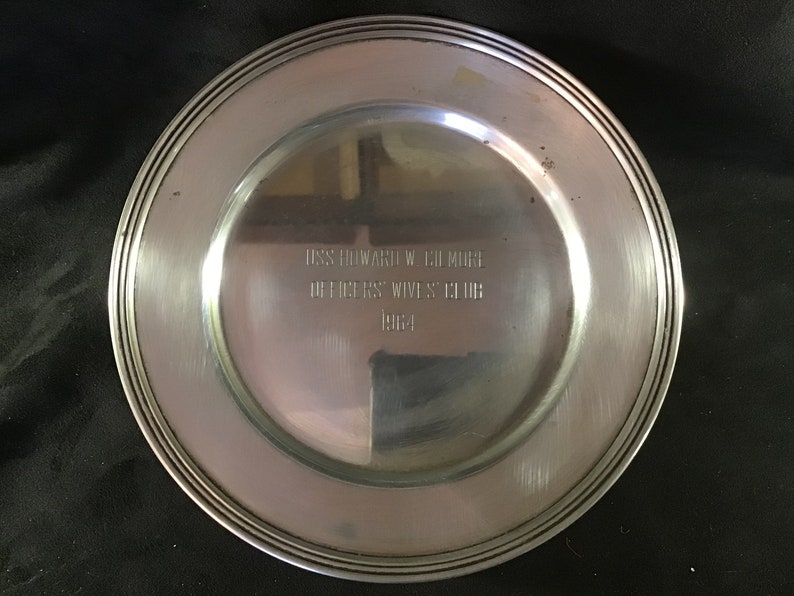
Where is `rim of plate`? Image resolution: width=794 pixels, height=596 pixels. rim of plate is located at coordinates (669, 226).